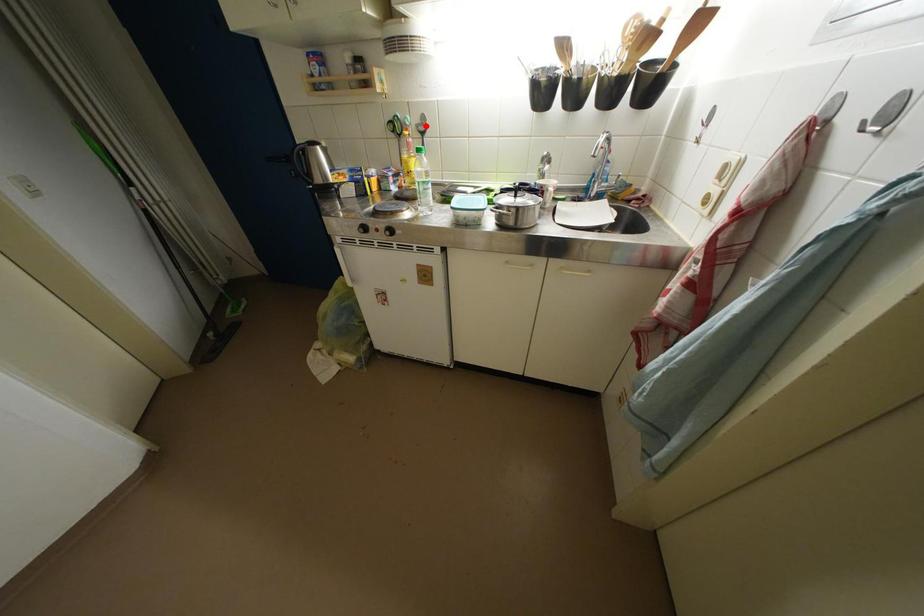
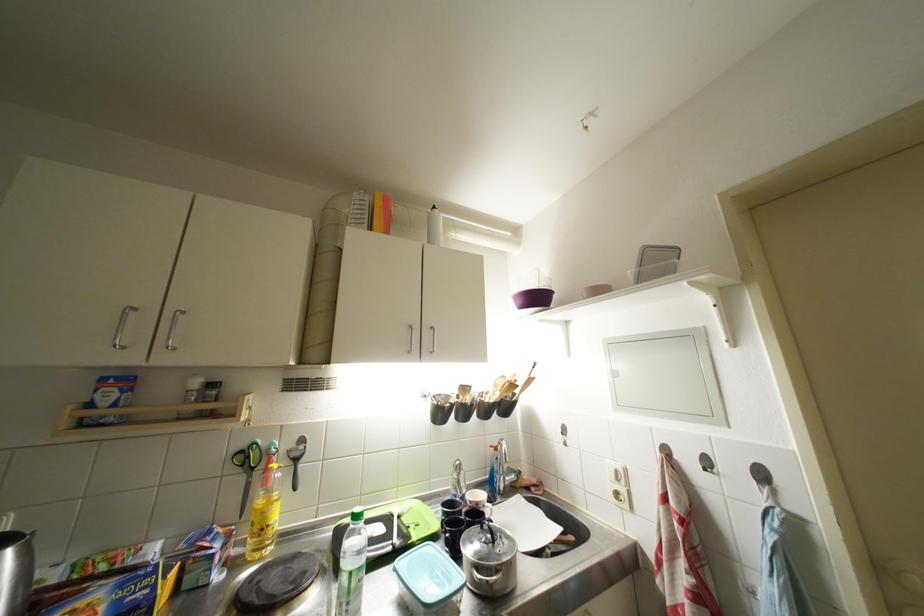
Where in the second image is the point corresponding to the highlighted location from the first image?

(299, 450)